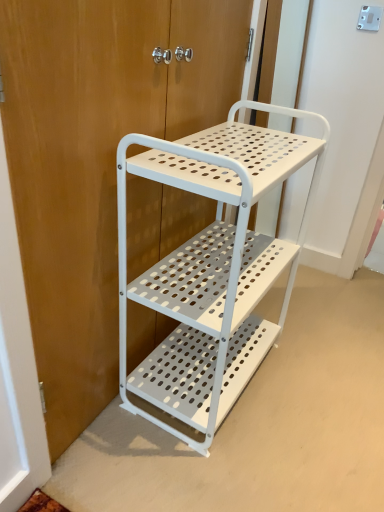
At what (x,y) coordinates should I click in order to perform the action: click on white perforated metal cart at center. Please return your answer as a coordinate pair (x, y). This screenshot has height=512, width=384. Looking at the image, I should click on (212, 268).

This screenshot has height=512, width=384. What do you see at coordinates (212, 268) in the screenshot?
I see `white perforated metal cart at center` at bounding box center [212, 268].

Image resolution: width=384 pixels, height=512 pixels. What do you see at coordinates (96, 161) in the screenshot?
I see `white metal door at center` at bounding box center [96, 161].

Identify the location of white metal door at center. The image size is (384, 512). (96, 161).

You are a GUI agent. You are given a task and a screenshot of the screen. Output one action in this format:
    pyautogui.click(x=<x>, y=<y>)
    Task: Click on the white perforated metal cart at center
    
    Given the screenshot: What is the action you would take?
    pyautogui.click(x=212, y=268)

Consider the image. Considering the positions of objects white perforated metal cart at center and white metal door at center in the image provided, who is more to the left, white perforated metal cart at center or white metal door at center?

Positioned to the left is white metal door at center.

Which object is more forward, white perforated metal cart at center or white metal door at center?

white metal door at center is closer to the camera.

Which point is more forward, (200,178) or (187,36)?

Point (200,178)

From the image's perspective, which one is positioned lower, white perforated metal cart at center or white metal door at center?

white perforated metal cart at center, from the image's perspective.

From a real-world perspective, is white perforated metal cart at center positioned under white metal door at center based on gravity?

Yes, from a real-world perspective, white perforated metal cart at center is beneath white metal door at center.

Looking at their sizes, would you say white perforated metal cart at center is wider or thinner than white metal door at center?

Considering their sizes, white perforated metal cart at center looks broader than white metal door at center.

Is white perforated metal cart at center taller than white metal door at center?

In fact, white perforated metal cart at center may be shorter than white metal door at center.

Who is smaller, white perforated metal cart at center or white metal door at center?

white metal door at center.

Is white perforated metal cart at center completely or partially outside of white metal door at center?

white perforated metal cart at center is positioned outside white metal door at center.

Is white perforated metal cart at center next to white metal door at center?

There is a gap between white perforated metal cart at center and white metal door at center.

Is white perforated metal cart at center oriented away from white metal door at center?

Yes, white metal door at center is at the back of white perforated metal cart at center.

How many degrees apart are the facing directions of white perforated metal cart at center and white metal door at center?

The facing directions of white perforated metal cart at center and white metal door at center are 1.02 degrees apart.

The height and width of the screenshot is (512, 384). I want to click on furniture located underneath the white metal door at center (from a real-world perspective), so pos(212,268).

Does white metal door at center appear on the right side of white perforated metal cart at center?

No, white metal door at center is not to the right of white perforated metal cart at center.

Does white metal door at center lie behind white perforated metal cart at center?

No, it is in front of white perforated metal cart at center.

Does point (41, 136) come behind point (185, 285)?

No, (41, 136) is in front of (185, 285).

From the image's perspective, does white metal door at center appear higher than white perforated metal cart at center?

Indeed, from the image's perspective, white metal door at center is shown above white perforated metal cart at center.

From a real-world perspective, is white metal door at center located beneath white perforated metal cart at center?

No, from a real-world perspective, white metal door at center is not beneath white perforated metal cart at center.

Considering the relative sizes of white metal door at center and white perforated metal cart at center in the image provided, is white metal door at center thinner than white perforated metal cart at center?

Yes.

Considering the sizes of objects white metal door at center and white perforated metal cart at center in the image provided, who is shorter, white metal door at center or white perforated metal cart at center?

white perforated metal cart at center.

Does white metal door at center have a smaller size compared to white perforated metal cart at center?

Indeed, white metal door at center has a smaller size compared to white perforated metal cart at center.

Choose the correct answer: Is white metal door at center inside white perforated metal cart at center or outside it?

white metal door at center is outside white perforated metal cart at center.

Can you see white metal door at center touching white perforated metal cart at center?

white metal door at center and white perforated metal cart at center are not in contact.

Is white perforated metal cart at center at the back of white metal door at center?

Yes, white metal door at center is facing away from white perforated metal cart at center.

How different are the orientations of white metal door at center and white perforated metal cart at center in degrees?

1.02 degrees.

Measure the distance from white metal door at center to white perforated metal cart at center.

white metal door at center is 7.58 inches away from white perforated metal cart at center.

The width and height of the screenshot is (384, 512). What are the coordinates of `door above the white perforated metal cart at center (from a real-world perspective)` in the screenshot? It's located at tap(96, 161).

This screenshot has width=384, height=512. I want to click on door above the white perforated metal cart at center (from a real-world perspective), so click(x=96, y=161).

Where is `furniture below the white metal door at center (from the image's perspective)`? The image size is (384, 512). furniture below the white metal door at center (from the image's perspective) is located at coordinates (212, 268).